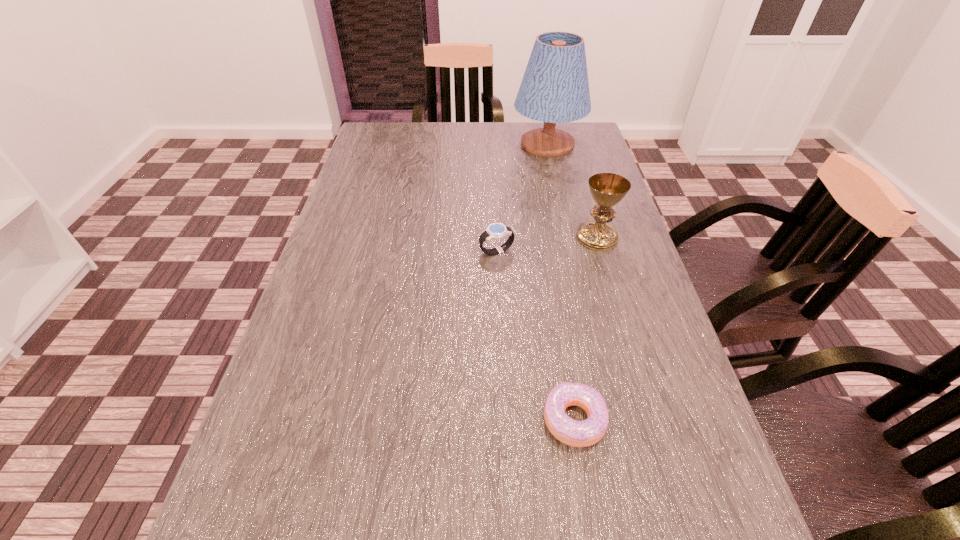
Where is `vacant space located on the left of the doughnut`? This screenshot has height=540, width=960. vacant space located on the left of the doughnut is located at coordinates [324, 419].

Image resolution: width=960 pixels, height=540 pixels. What are the coordinates of `object that is positioned at the far edge` in the screenshot? It's located at (555, 89).

In order to click on lampshade positioned at the right edge in this screenshot , I will do [555, 89].

You are a GUI agent. You are given a task and a screenshot of the screen. Output one action in this format:
    pyautogui.click(x=<x>, y=<y>)
    Task: Click on the chalice situated at the right edge
    The image size is (960, 540).
    Given the screenshot: What is the action you would take?
    pyautogui.click(x=607, y=189)

At what (x,y) coordinates should I click in order to perform the action: click on object situated at the far right corner. Please return your answer as a coordinate pair (x, y). This screenshot has height=540, width=960. Looking at the image, I should click on [x=555, y=89].

Identify the location of vacant space at the far edge. (473, 156).

The width and height of the screenshot is (960, 540). Find the location of `free location at the left edge of the desktop`. free location at the left edge of the desktop is located at coordinates (313, 273).

The image size is (960, 540). What are the coordinates of `blank area at the right edge` in the screenshot? It's located at (561, 168).

Locate an element on the screen. vacant space at the far left corner of the desktop is located at coordinates (413, 137).

This screenshot has height=540, width=960. Find the location of `empty location between the tallest object and the second tallest object`. empty location between the tallest object and the second tallest object is located at coordinates (572, 191).